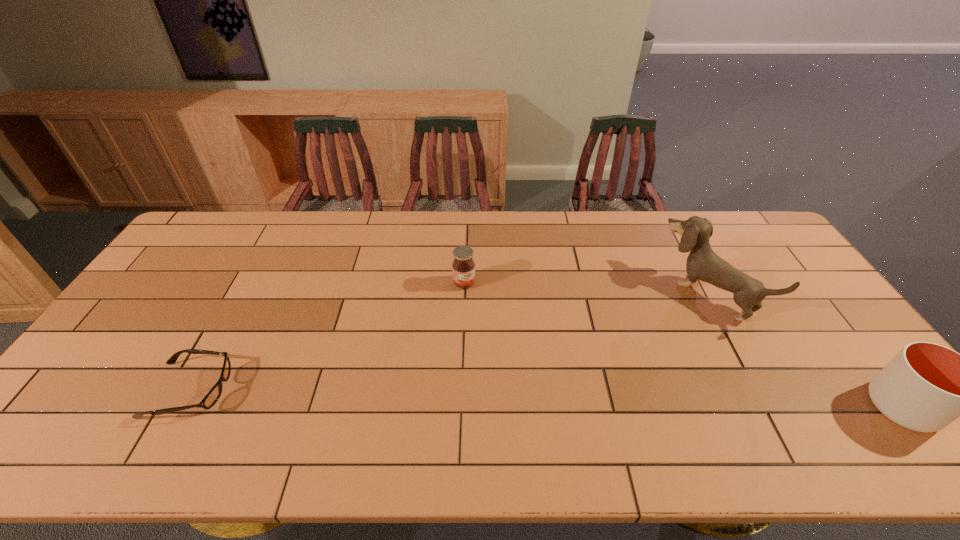
Find the location of a particular element. The height and width of the screenshot is (540, 960). free space on the desktop that is between the leftmost object and the cup and is positioned at the face of the third object from left to right is located at coordinates click(x=567, y=399).

Find the location of a particular element. vacant spot on the desktop that is between the leftmost object and the rightmost object and is positioned on the label side of the jam is located at coordinates (564, 399).